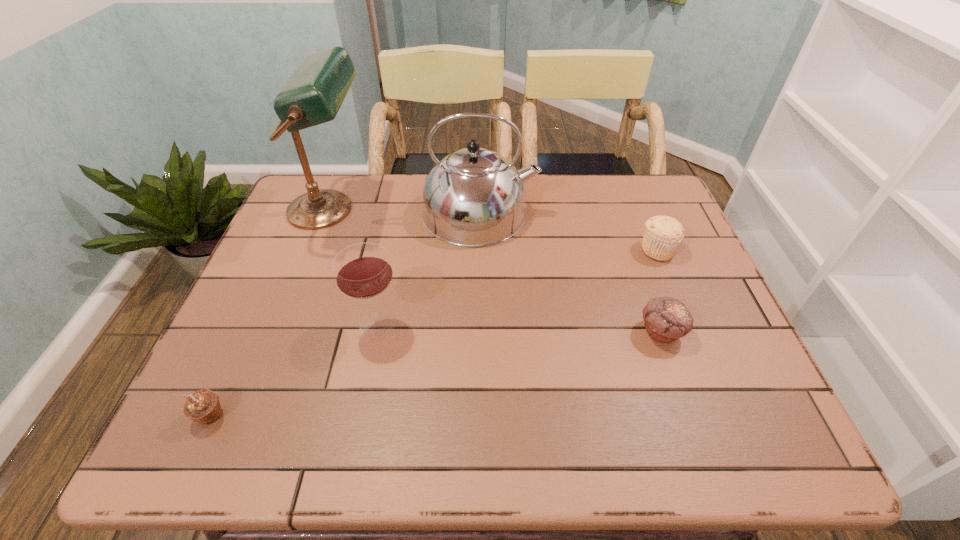
Find the location of a particular element. Image resolution: width=960 pixels, height=540 pixels. blank region between the second farthest muffin and the fourth object from left to right is located at coordinates (570, 272).

This screenshot has height=540, width=960. What are the coordinates of `free space that is in between the fifth shortest object and the leftmost muffin` in the screenshot? It's located at (345, 314).

Identify the location of free space that is in between the farthest muffin and the second nearest muffin. (660, 291).

You are a GUI agent. You are given a task and a screenshot of the screen. Output one action in this format:
    pyautogui.click(x=<x>, y=<y>)
    Task: Click on the vacant point located between the tallest object and the nearest object
    This screenshot has height=540, width=960.
    Given the screenshot: What is the action you would take?
    pyautogui.click(x=270, y=313)

This screenshot has width=960, height=540. Find the location of `free space between the second farthest muffin and the wineglass`. free space between the second farthest muffin and the wineglass is located at coordinates click(519, 328).

Identify the location of vacant space that's between the second nearest muffin and the farthest muffin. (660, 291).

I want to click on vacant area that lies between the farthest muffin and the wineglass, so (517, 287).

Locate an element on the screen. free space between the farthest muffin and the second nearest muffin is located at coordinates (660, 291).

The width and height of the screenshot is (960, 540). I want to click on the third closest object to the nearest object, so click(473, 197).

Choose which object is the second nearest neighbor to the kettle. Please provide its 2D coordinates. Your answer should be formatted as a tuple, i.e. [(x, y)], where the tuple contains the x and y coordinates of a point satisfying the conditions above.

[(363, 271)]